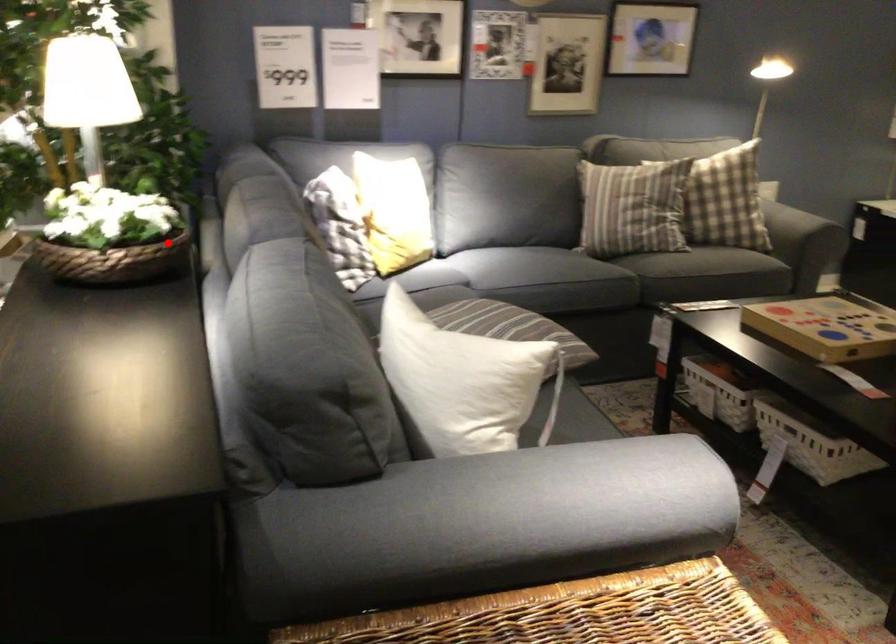
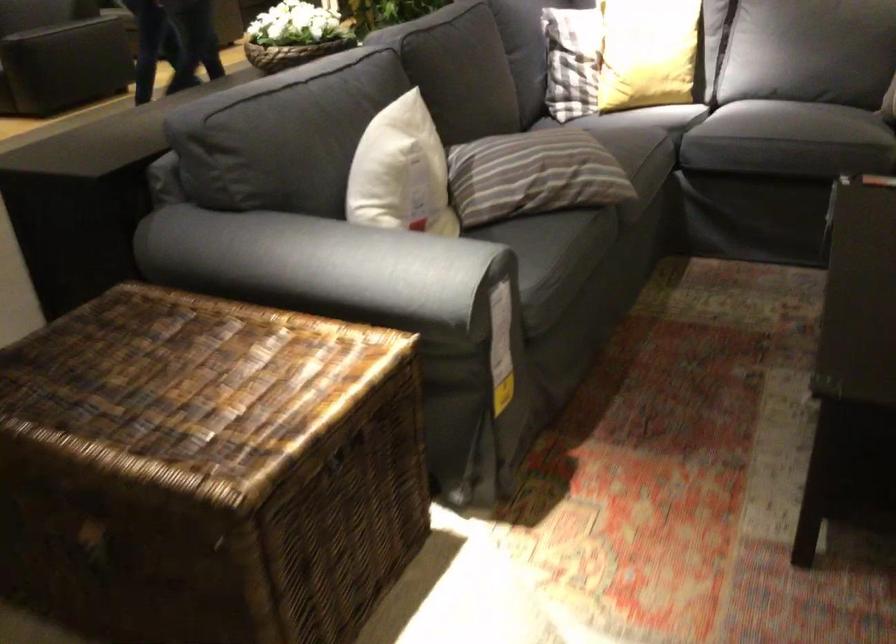
Question: I am providing you with two images of the same scene from different viewpoints. A red point is shown in image1. For the corresponding object point in image2, is it positioned nearer or farther from the camera?

Choices:
 (A) Nearer
 (B) Farther

Answer: (B)